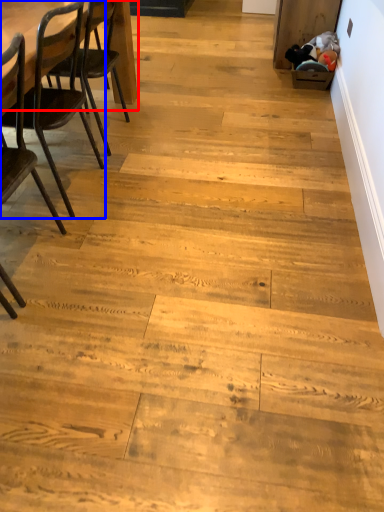
Question: Which of the following is the closest to the observer, table (highlighted by a red box) or chair (highlighted by a blue box)?

Choices:
 (A) table
 (B) chair

Answer: (B)